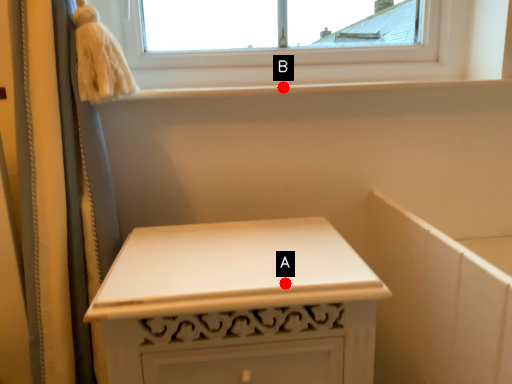
Question: Two points are circled on the image, labeled by A and B beside each circle. Which point is closer to the camera?

Choices:
 (A) A is closer
 (B) B is closer

Answer: (A)